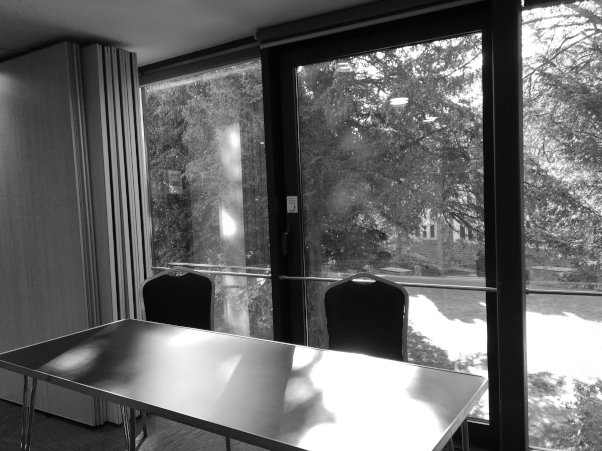
Where is `left chair`? left chair is located at coordinates (181, 295).